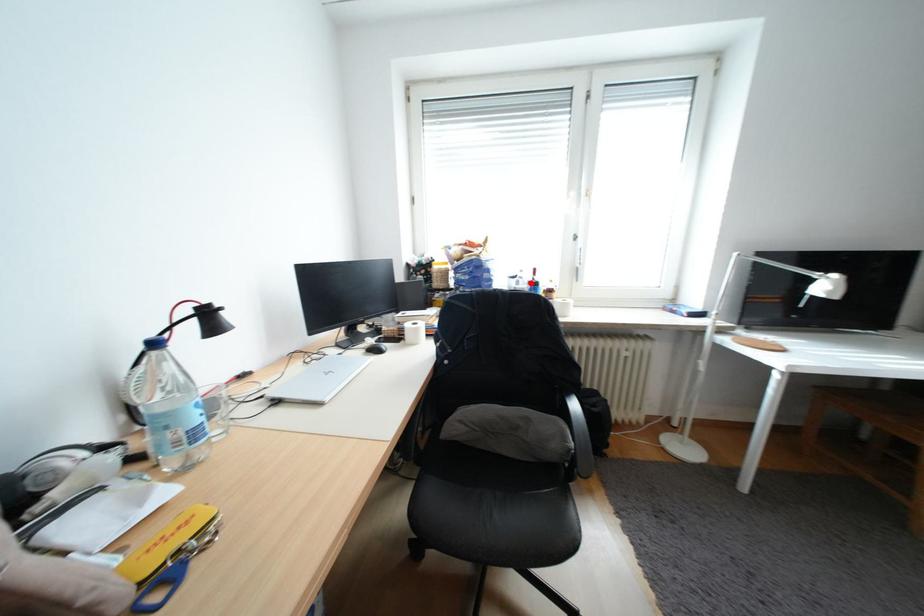
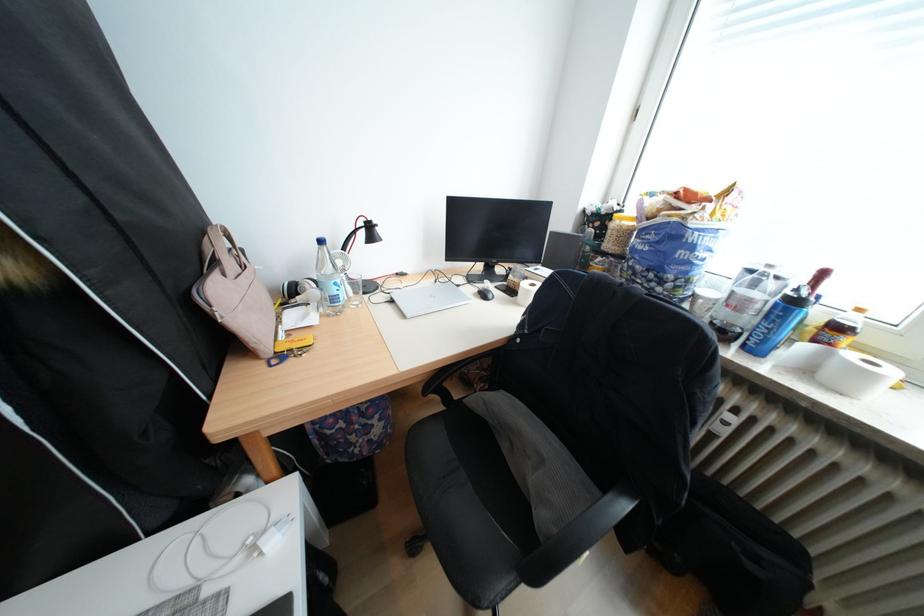
The point at the highlighted location is marked in the first image. Where is the corresponding point in the second image?

(767, 285)